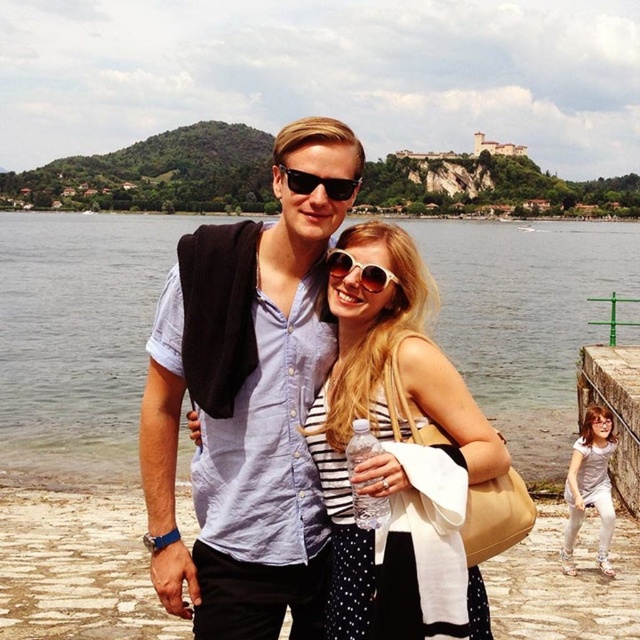
Question: Does matte blue shirt at center have a larger size compared to black plastic sunglasses at center?

Choices:
 (A) yes
 (B) no

Answer: (A)

Question: Does matte blue shirt at center appear under black plastic sunglasses at center?

Choices:
 (A) yes
 (B) no

Answer: (A)

Question: Which point appears farthest from the camera in this image?

Choices:
 (A) (x=476, y=620)
 (B) (x=186, y=348)
 (C) (x=353, y=189)

Answer: (C)

Question: Based on their relative distances, which object is nearer to the clear water at center?

Choices:
 (A) black plastic sunglasses at center
 (B) matte blue shirt at center
 (C) light pink fabric dress at lower right

Answer: (B)

Question: Which of the following is the closest to the observer?

Choices:
 (A) white striped dress at center
 (B) clear water at center

Answer: (A)

Question: Is matte blue shirt at center to the right of light pink fabric dress at lower right from the viewer's perspective?

Choices:
 (A) no
 (B) yes

Answer: (A)